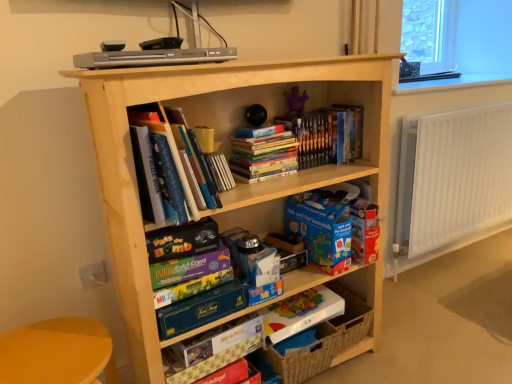
Question: From the image's perspective, does hardcover books at upper center, placed as the third book when sorted from left to right, appear higher than yellow plastic table at lower left?

Choices:
 (A) no
 (B) yes

Answer: (B)

Question: Can you confirm if hardcover books at upper center, placed as the third book when sorted from left to right, is bigger than yellow plastic table at lower left?

Choices:
 (A) yes
 (B) no

Answer: (B)

Question: Considering the relative sizes of hardcover books at upper center, the 1th book viewed from the right, and yellow plastic table at lower left in the image provided, is hardcover books at upper center, the 1th book viewed from the right, thinner than yellow plastic table at lower left?

Choices:
 (A) no
 (B) yes

Answer: (B)

Question: From a real-world perspective, is hardcover books at upper center, the 1th book viewed from the right, physically above yellow plastic table at lower left?

Choices:
 (A) yes
 (B) no

Answer: (A)

Question: Can you confirm if hardcover books at upper center, the 1th book viewed from the right, is taller than yellow plastic table at lower left?

Choices:
 (A) no
 (B) yes

Answer: (A)

Question: In terms of height, does multicolored cardboard game box at center, placed as the fourth paperback book when sorted from bottom to top, look taller or shorter compared to hardcover books at upper center, the 1th book viewed from the right?

Choices:
 (A) short
 (B) tall

Answer: (A)

Question: Considering their positions, is multicolored cardboard game box at center, the third paperback book in the top-to-bottom sequence, located in front of or behind hardcover books at upper center, placed as the third book when sorted from left to right?

Choices:
 (A) behind
 (B) front

Answer: (B)

Question: From the image's perspective, is multicolored cardboard game box at center, placed as the fourth paperback book when sorted from bottom to top, located above or below hardcover books at upper center, placed as the third book when sorted from left to right?

Choices:
 (A) below
 (B) above

Answer: (A)

Question: From a real-world perspective, is multicolored cardboard game box at center, placed as the fourth paperback book when sorted from bottom to top, positioned above or below hardcover books at upper center, the 1th book viewed from the right?

Choices:
 (A) below
 (B) above

Answer: (A)

Question: Is transparent glass window at upper right in front of or behind purple fabric toy at upper center in the image?

Choices:
 (A) front
 (B) behind

Answer: (B)

Question: Based on their sizes in the image, would you say transparent glass window at upper right is bigger or smaller than purple fabric toy at upper center?

Choices:
 (A) small
 (B) big

Answer: (B)

Question: Is point (429, 19) closer or farther from the camera than point (305, 99)?

Choices:
 (A) closer
 (B) farther

Answer: (B)

Question: From a real-world perspective, is transparent glass window at upper right above or below purple fabric toy at upper center?

Choices:
 (A) above
 (B) below

Answer: (A)

Question: Is point (287, 150) closer or farther from the camera than point (357, 76)?

Choices:
 (A) farther
 (B) closer

Answer: (A)

Question: Would you say hardcover books at center, the second book from the left, is to the left or to the right of light wood bookcase at center in the picture?

Choices:
 (A) right
 (B) left

Answer: (A)